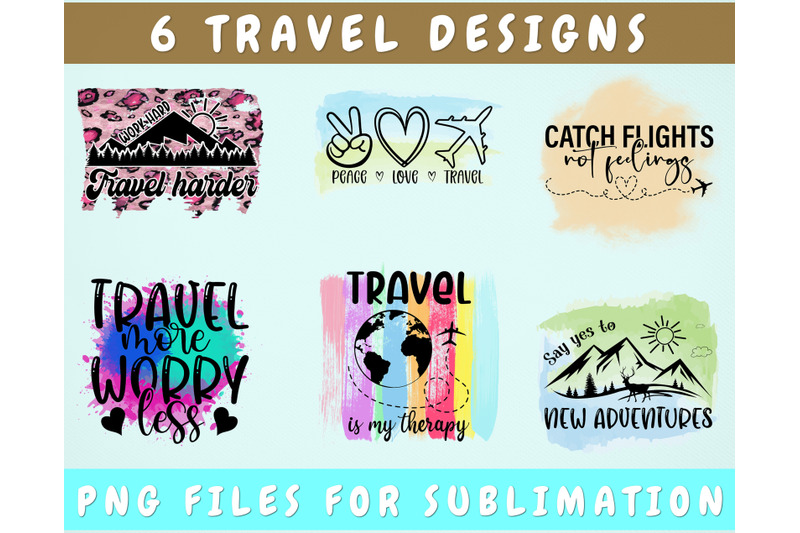
Image resolution: width=800 pixels, height=533 pixels. What are the coordinates of `globe` in the screenshot? It's located at click(390, 340).